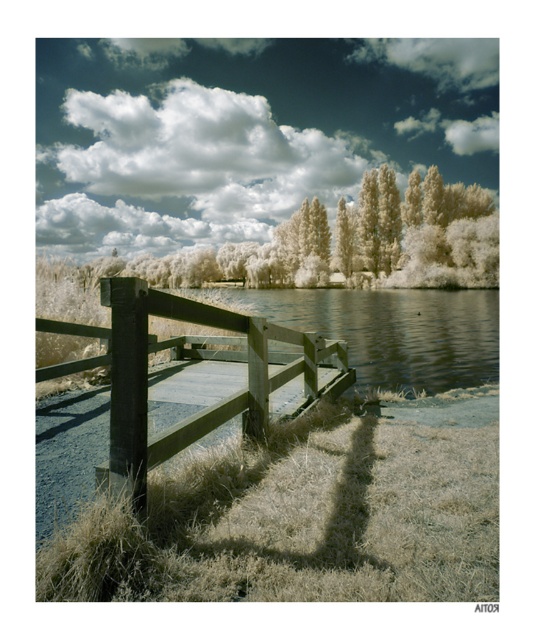
Question: Is wooden fence at center closer to the viewer compared to smooth gray water at center?

Choices:
 (A) yes
 (B) no

Answer: (A)

Question: Which object is the farthest from the white fluffy cloud at upper center?

Choices:
 (A) wooden fence at center
 (B) smooth gray water at center

Answer: (A)

Question: Based on their relative distances, which object is nearer to the wooden fence at center?

Choices:
 (A) white fluffy cloud at upper center
 (B) white fluffy trees at upper center

Answer: (B)

Question: Does white fluffy cloud at upper center have a larger size compared to smooth gray water at center?

Choices:
 (A) yes
 (B) no

Answer: (A)

Question: Does white fluffy cloud at upper center appear on the right side of smooth gray water at center?

Choices:
 (A) yes
 (B) no

Answer: (B)

Question: Considering the real-world distances, which object is farthest from the white fluffy cloud at upper center?

Choices:
 (A) white fluffy trees at upper center
 (B) smooth gray water at center

Answer: (B)